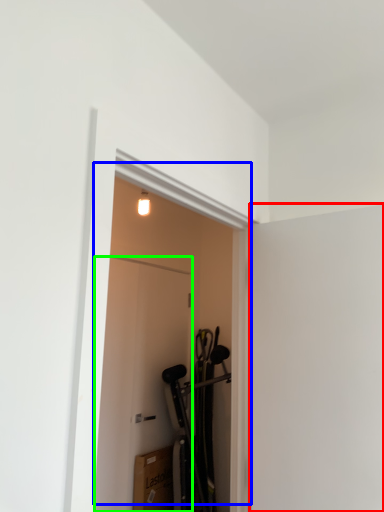
Question: Estimate the real-world distances between objects in this image. Which object is farther from screen door (highlighted by a red box), door (highlighted by a blue box) or door (highlighted by a green box)?

Choices:
 (A) door
 (B) door

Answer: (A)